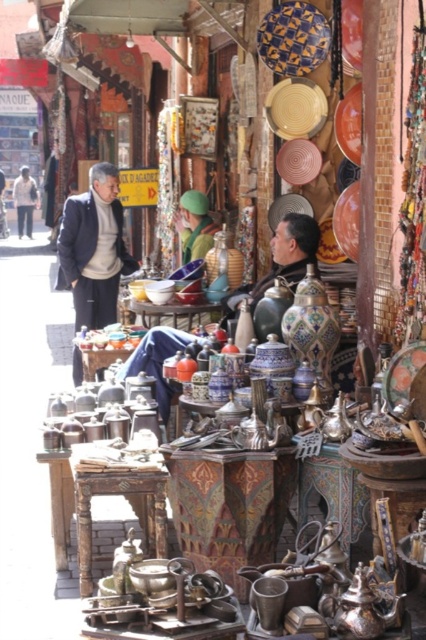
How much distance is there between dark gray suit at center and white cotton jacket at left?

The distance of dark gray suit at center from white cotton jacket at left is 51.58 meters.

The image size is (426, 640). Describe the element at coordinates (94, 248) in the screenshot. I see `dark gray suit at center` at that location.

Between point (103, 321) and point (17, 234), which one is positioned behind?

Point (17, 234)

Identify the location of dark gray suit at center. (94, 248).

Is point (108, 204) more distant than point (293, 268)?

That is True.

Is dark gray suit at center taller than matte brown leather jacket at center?

Yes.

Where is `dark gray suit at center`? dark gray suit at center is located at coordinates (94, 248).

Where is `matte brown leather jacket at center`? This screenshot has width=426, height=640. matte brown leather jacket at center is located at coordinates (281, 260).

Who is taller, matte brown leather jacket at center or white cotton jacket at left?

matte brown leather jacket at center is taller.

Describe the element at coordinates (281, 260) in the screenshot. I see `matte brown leather jacket at center` at that location.

Image resolution: width=426 pixels, height=640 pixels. What are the coordinates of `matte brown leather jacket at center` in the screenshot? It's located at (281, 260).